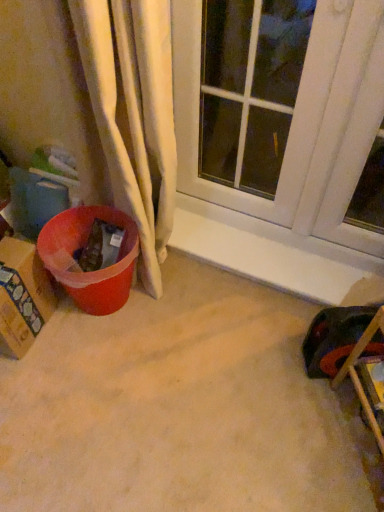
Where is `vacant space to the left of wooden chair at lower right`? Image resolution: width=384 pixels, height=512 pixels. vacant space to the left of wooden chair at lower right is located at coordinates (299, 438).